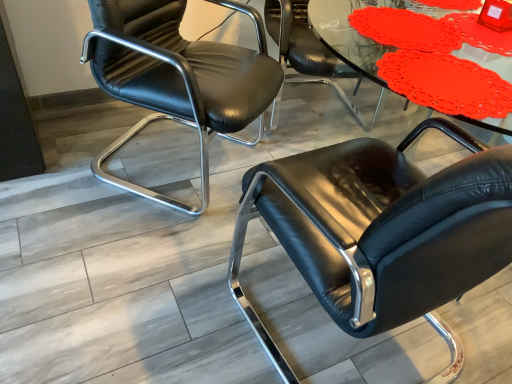
Looking at this image, how much space does black leather chair at left, marked as the 3th chair in a right-to-left arrangement, occupy vertically?

The height of black leather chair at left, marked as the 3th chair in a right-to-left arrangement, is 85.30 centimeters.

What do you see at coordinates (309, 52) in the screenshot?
I see `black leather chair at center, which is counted as the second chair, starting from the right` at bounding box center [309, 52].

In order to face matte plastic table at upper center, should I rotate leftwards or rightwards?

To align with it, rotate right about 24.263°.

This screenshot has height=384, width=512. I want to click on matte plastic table at upper center, so click(345, 36).

Where is `black leather chair at left, marked as the 3th chair in a right-to-left arrangement`? black leather chair at left, marked as the 3th chair in a right-to-left arrangement is located at coordinates (177, 77).

Can you confirm if black leather chair at center, the second chair when ordered from left to right, is bigger than matte plastic table at upper center?

Yes, black leather chair at center, the second chair when ordered from left to right, is bigger than matte plastic table at upper center.

From a real-world perspective, is black leather chair at center, the second chair when ordered from left to right, located beneath matte plastic table at upper center?

Yes, from a real-world perspective, black leather chair at center, the second chair when ordered from left to right, is under matte plastic table at upper center.

From a real-world perspective, is black leather chair at center, the second chair when ordered from left to right, positioned above or below black leather chair at left, placed as the 1th chair when sorted from left to right?

Clearly, from a real-world perspective, black leather chair at center, the second chair when ordered from left to right, is below black leather chair at left, placed as the 1th chair when sorted from left to right.

Who is more distant, black leather chair at center, which is counted as the second chair, starting from the right, or black leather chair at left, placed as the 1th chair when sorted from left to right?

black leather chair at center, which is counted as the second chair, starting from the right, is behind.

Is black leather chair at center, which is counted as the second chair, starting from the right, facing towards black leather chair at left, marked as the 3th chair in a right-to-left arrangement?

No, black leather chair at center, which is counted as the second chair, starting from the right, is not aimed at black leather chair at left, marked as the 3th chair in a right-to-left arrangement.

Is black leather chair at left, placed as the 1th chair when sorted from left to right, turned away from matte plastic table at upper center?

black leather chair at left, placed as the 1th chair when sorted from left to right, does not have its back to matte plastic table at upper center.

What are the coordinates of `table that appears in front of the black leather chair at left, placed as the 1th chair when sorted from left to right` in the screenshot? It's located at (345, 36).

Looking at this image, which of these two, black leather chair at left, marked as the 3th chair in a right-to-left arrangement, or matte plastic table at upper center, is wider?

black leather chair at left, marked as the 3th chair in a right-to-left arrangement, is wider.

Is black leather chair at left, marked as the 3th chair in a right-to-left arrangement, positioned before matte plastic table at upper center?

No, black leather chair at left, marked as the 3th chair in a right-to-left arrangement, is further to the viewer.

Is black leather chair at center, which appears as the third chair when viewed from the left, further to camera compared to black leather chair at center, which is counted as the second chair, starting from the right?

No, it is not.

Is black leather chair at center, which appears as the third chair when viewed from the left, at the left side of black leather chair at center, the second chair when ordered from left to right?

In fact, black leather chair at center, which appears as the third chair when viewed from the left, is to the right of black leather chair at center, the second chair when ordered from left to right.

From the picture: What's the angular difference between black leather chair at center, which appears as the third chair when viewed from the left, and black leather chair at center, which is counted as the second chair, starting from the right,'s facing directions?

There is a 16.3-degree angle between the facing directions of black leather chair at center, which appears as the third chair when viewed from the left, and black leather chair at center, which is counted as the second chair, starting from the right.

Considering the relative sizes of black leather chair at center, which appears as the third chair when viewed from the left, and black leather chair at center, the second chair when ordered from left to right, in the image provided, is black leather chair at center, which appears as the third chair when viewed from the left, wider than black leather chair at center, the second chair when ordered from left to right,?

Yes, black leather chair at center, which appears as the third chair when viewed from the left, is wider than black leather chair at center, the second chair when ordered from left to right.

From a real-world perspective, which is physically below, black leather chair at center, the second chair when ordered from left to right, or black leather chair at center, which appears as the third chair when viewed from the left?

black leather chair at center, the second chair when ordered from left to right, from a real-world perspective.

From the image's perspective, who appears lower, black leather chair at center, the second chair when ordered from left to right, or black leather chair at center, which appears as the third chair when viewed from the left?

black leather chair at center, which appears as the third chair when viewed from the left, from the image's perspective.

Is black leather chair at center, which is counted as the second chair, starting from the right, facing towards black leather chair at center, the first chair positioned from the right?

Yes, black leather chair at center, which is counted as the second chair, starting from the right, faces towards black leather chair at center, the first chair positioned from the right.

Between black leather chair at center, which is counted as the second chair, starting from the right, and black leather chair at center, the first chair positioned from the right, which one is positioned behind?

Positioned behind is black leather chair at center, which is counted as the second chair, starting from the right.

What's the angular difference between black leather chair at center, the first chair positioned from the right, and matte plastic table at upper center's facing directions?

There is a 0.000171-degree angle between the facing directions of black leather chair at center, the first chair positioned from the right, and matte plastic table at upper center.

From the image's perspective, is black leather chair at center, the first chair positioned from the right, positioned above or below matte plastic table at upper center?

A: black leather chair at center, the first chair positioned from the right, is below matte plastic table at upper center.

Is black leather chair at center, the first chair positioned from the right, oriented away from matte plastic table at upper center?

No, black leather chair at center, the first chair positioned from the right, is not facing the opposite direction of matte plastic table at upper center.

From the picture: Is black leather chair at center, the first chair positioned from the right, not near matte plastic table at upper center?

No, black leather chair at center, the first chair positioned from the right, is not far from matte plastic table at upper center.

Is point (353, 44) closer to viewer compared to point (360, 317)?

That is False.

Find the location of `table located above the black leather chair at center, the first chair positioned from the right (from the image's perspective)`. table located above the black leather chair at center, the first chair positioned from the right (from the image's perspective) is located at coordinates (345, 36).

How different are the orientations of matte plastic table at upper center and black leather chair at center, the first chair positioned from the right, in degrees?

They differ by 0.000171 degrees in their facing directions.

From a real-world perspective, between matte plastic table at upper center and black leather chair at center, which appears as the third chair when viewed from the left, who is vertically lower?

black leather chair at center, which appears as the third chair when viewed from the left.

I want to click on the 1st chair to the left when counting from the matte plastic table at upper center, so click(x=309, y=52).

This screenshot has width=512, height=384. What are the coordinates of `chair lying behind the black leather chair at left, placed as the 1th chair when sorted from left to right` in the screenshot? It's located at (309, 52).

From the image, which object appears to be farther from black leather chair at left, placed as the 1th chair when sorted from left to right, matte plastic table at upper center or black leather chair at center, which appears as the third chair when viewed from the left?

Based on the image, matte plastic table at upper center appears to be further to black leather chair at left, placed as the 1th chair when sorted from left to right.

Considering their positions, is black leather chair at center, the first chair positioned from the right, positioned further to matte plastic table at upper center than black leather chair at left, placed as the 1th chair when sorted from left to right?

black leather chair at left, placed as the 1th chair when sorted from left to right, is further to matte plastic table at upper center.

When comparing their distances from black leather chair at left, marked as the 3th chair in a right-to-left arrangement, does black leather chair at center, which is counted as the second chair, starting from the right, or black leather chair at center, which appears as the third chair when viewed from the left, seem closer?

Among the two, black leather chair at center, which is counted as the second chair, starting from the right, is located nearer to black leather chair at left, marked as the 3th chair in a right-to-left arrangement.

From the image, which object appears to be nearer to black leather chair at left, placed as the 1th chair when sorted from left to right, black leather chair at center, the first chair positioned from the right, or matte plastic table at upper center?

The object closer to black leather chair at left, placed as the 1th chair when sorted from left to right, is black leather chair at center, the first chair positioned from the right.

From the image, which object appears to be farther from black leather chair at center, which is counted as the second chair, starting from the right, matte plastic table at upper center or black leather chair at left, placed as the 1th chair when sorted from left to right?

black leather chair at left, placed as the 1th chair when sorted from left to right, lies further to black leather chair at center, which is counted as the second chair, starting from the right, than the other object.

Looking at the image, which one is located closer to black leather chair at center, the second chair when ordered from left to right, black leather chair at center, which appears as the third chair when viewed from the left, or black leather chair at left, marked as the 3th chair in a right-to-left arrangement?

The object closer to black leather chair at center, the second chair when ordered from left to right, is black leather chair at left, marked as the 3th chair in a right-to-left arrangement.

From the image, which object appears to be farther from matte plastic table at upper center, black leather chair at center, the second chair when ordered from left to right, or black leather chair at left, marked as the 3th chair in a right-to-left arrangement?

Among the two, black leather chair at left, marked as the 3th chair in a right-to-left arrangement, is located further to matte plastic table at upper center.

Estimate the real-world distances between objects in this image. Which object is closer to matte plastic table at upper center, black leather chair at left, marked as the 3th chair in a right-to-left arrangement, or black leather chair at center, the second chair when ordered from left to right?

black leather chair at center, the second chair when ordered from left to right.

Identify the location of table positioned between black leather chair at center, the first chair positioned from the right, and black leather chair at center, the second chair when ordered from left to right, from near to far. (345, 36).

You are a GUI agent. You are given a task and a screenshot of the screen. Output one action in this format:
    pyautogui.click(x=<x>, y=<y>)
    Task: Click on the chair between black leather chair at left, placed as the 1th chair when sorted from left to right, and matte plastic table at upper center
    The width and height of the screenshot is (512, 384).
    Given the screenshot: What is the action you would take?
    pyautogui.click(x=309, y=52)

At what (x,y) coordinates should I click in order to perform the action: click on table between black leather chair at left, placed as the 1th chair when sorted from left to right, and black leather chair at center, the first chair positioned from the right. Please return your answer as a coordinate pair (x, y). The height and width of the screenshot is (384, 512). Looking at the image, I should click on (345, 36).

You are a GUI agent. You are given a task and a screenshot of the screen. Output one action in this format:
    pyautogui.click(x=<x>, y=<y>)
    Task: Click on the chair between black leather chair at left, marked as the 3th chair in a right-to-left arrangement, and black leather chair at center, the first chair positioned from the right, from left to right
    The width and height of the screenshot is (512, 384).
    Given the screenshot: What is the action you would take?
    pyautogui.click(x=309, y=52)